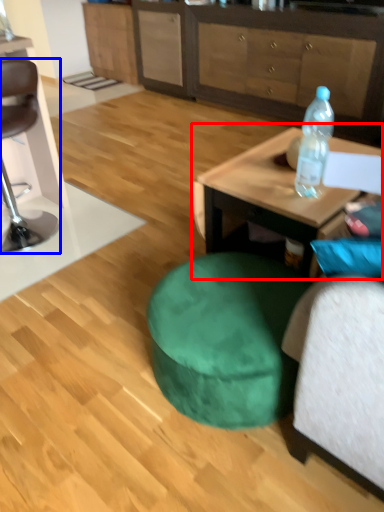
Question: Which object appears closest to the camera in this image, coffee table (highlighted by a red box) or chair (highlighted by a blue box)?

Choices:
 (A) coffee table
 (B) chair

Answer: (A)